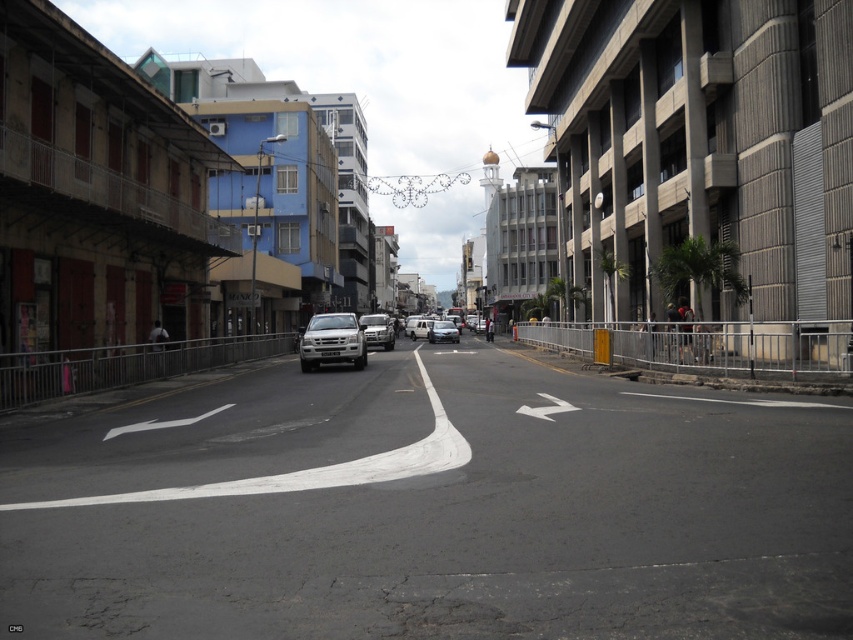
You are standing at the center of the street looking towards the buildings. There are two points marked on the road ahead of you. The first point is at coordinates point (383, 467) and the second is at point (428, 337). Which point is closer to you?

Point (383, 467) is closer to the viewer than point (428, 337).

You are a delivery person who needs to load a tall package into either the silver metallic car at center or the white matte van at center. Which vehicle should you choose to ensure the package fits vertically?

The silver metallic car at center has a greater height compared to the white matte van at center, so you should choose the silver metallic car at center to ensure the tall package fits vertically.

You are a pedestrian standing at the edge of the street. You see a silver metallic car at center and a white matte van at center. Which vehicle is nearer to you?

The silver metallic car at center is closer to the viewer than the white matte van at center, so the silver metallic car at center is nearer to you.